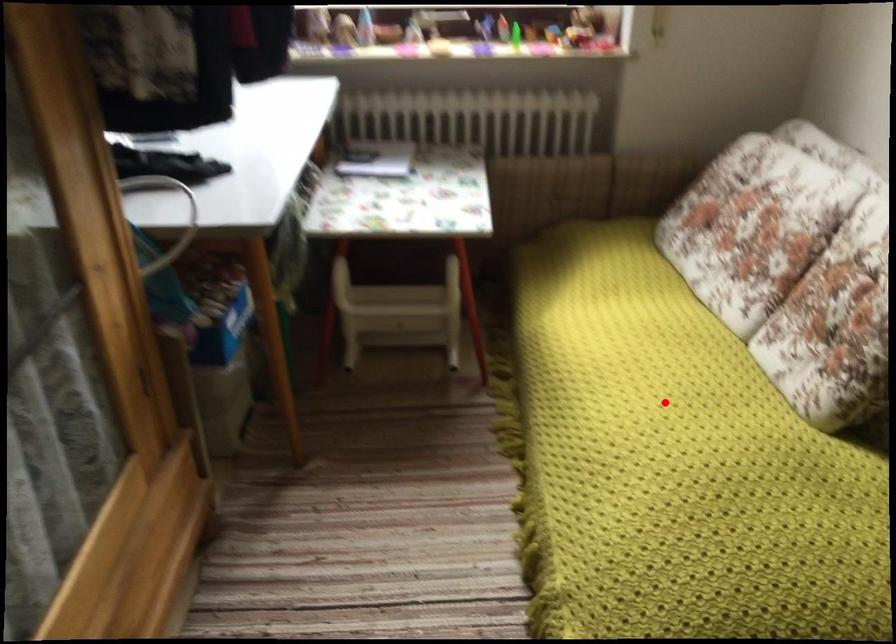
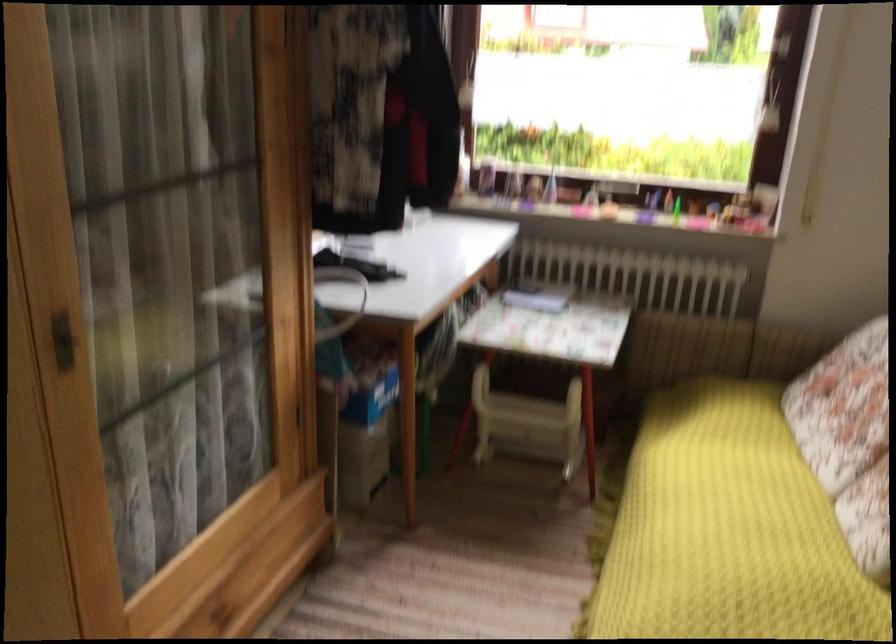
Where in the second image is the point corresponding to the highlighted location from the first image?

(728, 529)